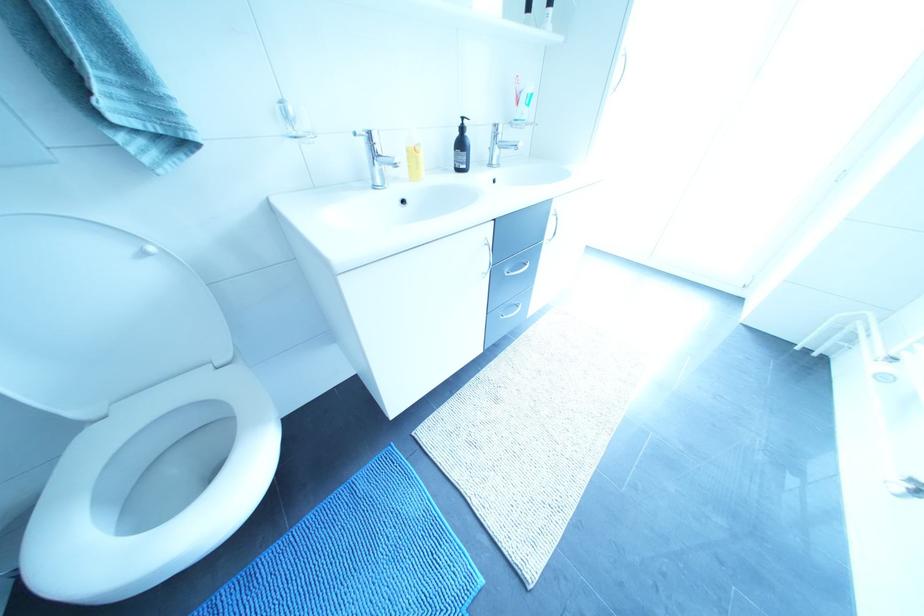
Image resolution: width=924 pixels, height=616 pixels. Identify the location of silver cabinet handle. (517, 270).